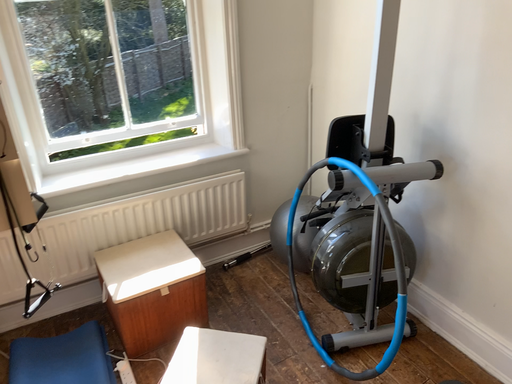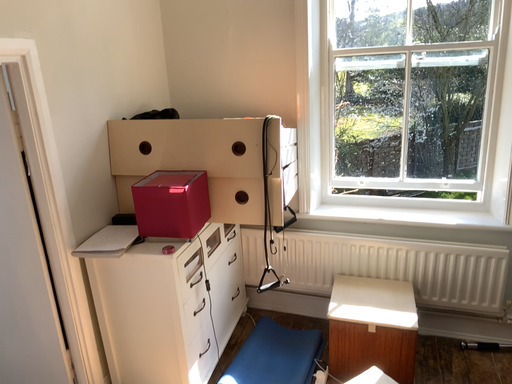
Question: How did the camera likely rotate when shooting the video?

Choices:
 (A) rotated right
 (B) rotated left

Answer: (B)